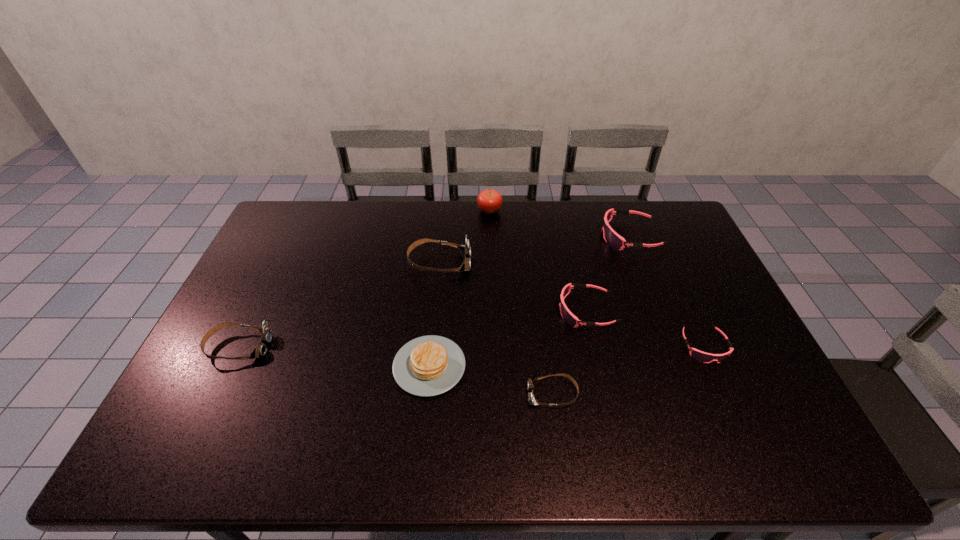
In order to click on vacant space at the far edge of the desktop in this screenshot , I will do `click(467, 212)`.

Find the location of a particular element. vacant region at the left edge of the desktop is located at coordinates (252, 332).

Where is `vacant space at the right edge of the desktop`? vacant space at the right edge of the desktop is located at coordinates (723, 299).

The height and width of the screenshot is (540, 960). What are the coordinates of `vacant space at the far left corner of the desktop` in the screenshot? It's located at (291, 225).

This screenshot has height=540, width=960. In order to click on blank space at the far right corner of the desktop in this screenshot , I will do `click(661, 215)`.

The height and width of the screenshot is (540, 960). I want to click on vacant space that's between the farthest pink goggles and the red apple, so click(560, 224).

Where is `vacant region between the farthest brown goggles and the smallest pink goggles`? The width and height of the screenshot is (960, 540). vacant region between the farthest brown goggles and the smallest pink goggles is located at coordinates (572, 305).

Where is `empty space between the second smallest pink goggles and the smallest brown goggles`? The height and width of the screenshot is (540, 960). empty space between the second smallest pink goggles and the smallest brown goggles is located at coordinates (569, 353).

Where is `empty space between the leftmost goggles and the second goggles from left to right`? empty space between the leftmost goggles and the second goggles from left to right is located at coordinates (339, 305).

You are a GUI agent. You are given a task and a screenshot of the screen. Output one action in this format:
    pyautogui.click(x=<x>, y=<y>)
    Task: Click on the vacant area between the nearest brown goggles and the pancake
    This screenshot has height=540, width=960.
    Given the screenshot: What is the action you would take?
    pyautogui.click(x=491, y=380)